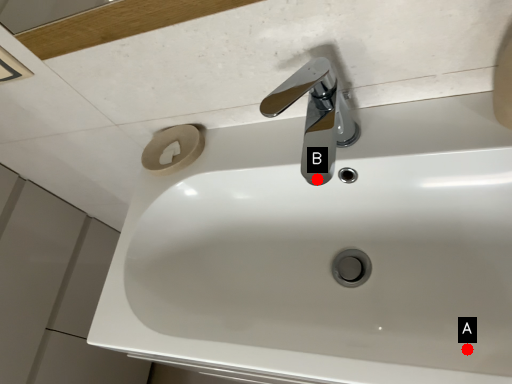
Question: Two points are circled on the image, labeled by A and B beside each circle. Which point appears closest to the camera in this image?

Choices:
 (A) A is closer
 (B) B is closer

Answer: (A)